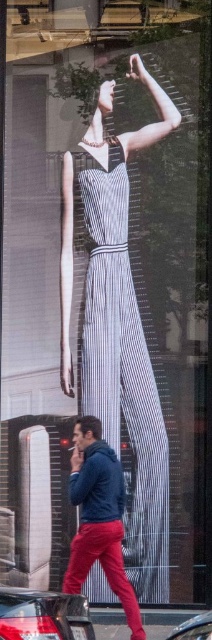
You are a photographer trying to capture the shiny black car at lower left without the matte blue hoodie at center blocking the view. Is this possible given their sizes?

The matte blue hoodie at center is bigger than the shiny black car at lower left, so it may block the view of the car depending on their positions. However, since the car is at lower left and the hoodie is at center, adjusting the camera angle slightly downward or to the side might allow you to frame the shot without the hoodie obstructing the car.